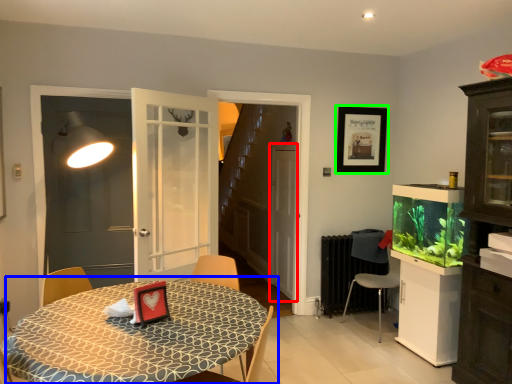
Question: Based on their relative distances, which object is nearer to screen door (highlighted by a red box)? Choose from table (highlighted by a blue box) and picture frame (highlighted by a green box).

Choices:
 (A) table
 (B) picture frame

Answer: (B)